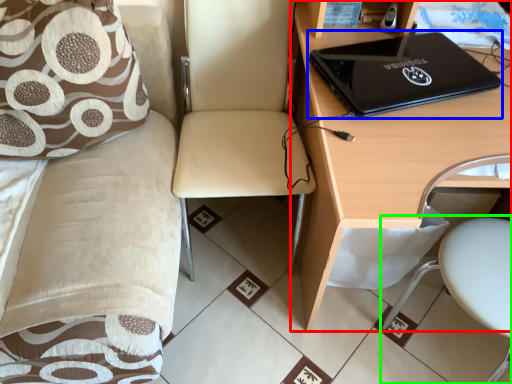
Question: Which object is the closest to the desk (highlighted by a red box)? Choose among these: laptop (highlighted by a blue box) or swivel chair (highlighted by a green box).

Choices:
 (A) laptop
 (B) swivel chair

Answer: (A)